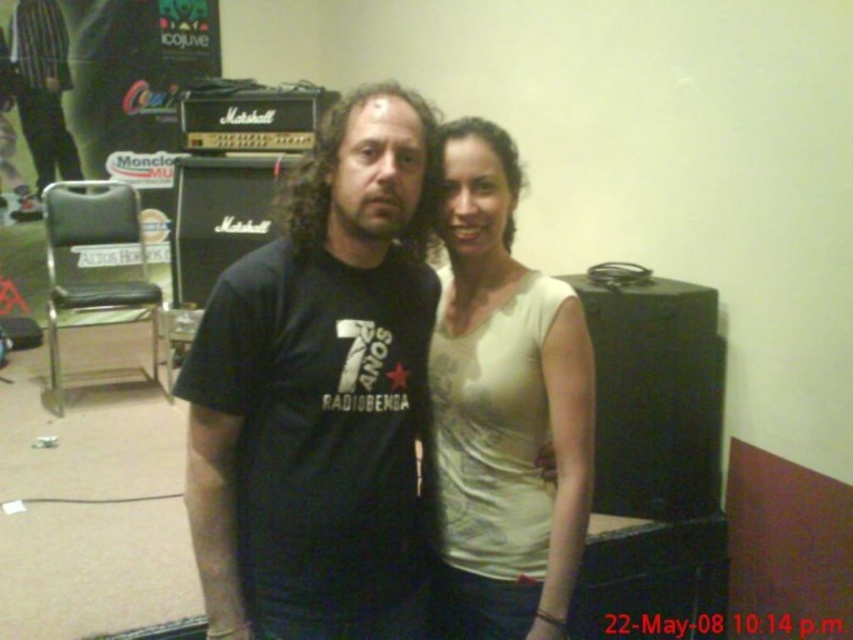
Question: Is white matte tank top at center thinner than matte black t-shirt at center?

Choices:
 (A) no
 (B) yes

Answer: (A)

Question: Which of these objects is positioned farthest from the black matte t-shirt at center?

Choices:
 (A) matte black t-shirt at center
 (B) white matte tank top at center

Answer: (A)

Question: Can you confirm if black matte t-shirt at center is wider than white matte tank top at center?

Choices:
 (A) yes
 (B) no

Answer: (A)

Question: Is black matte t-shirt at center above matte black t-shirt at center?

Choices:
 (A) no
 (B) yes

Answer: (A)

Question: Considering the real-world distances, which object is farthest from the black matte t-shirt at center?

Choices:
 (A) white matte tank top at center
 (B) matte black t-shirt at center

Answer: (B)

Question: Which of the following is the farthest from the observer?

Choices:
 (A) matte black t-shirt at center
 (B) black matte t-shirt at center

Answer: (A)